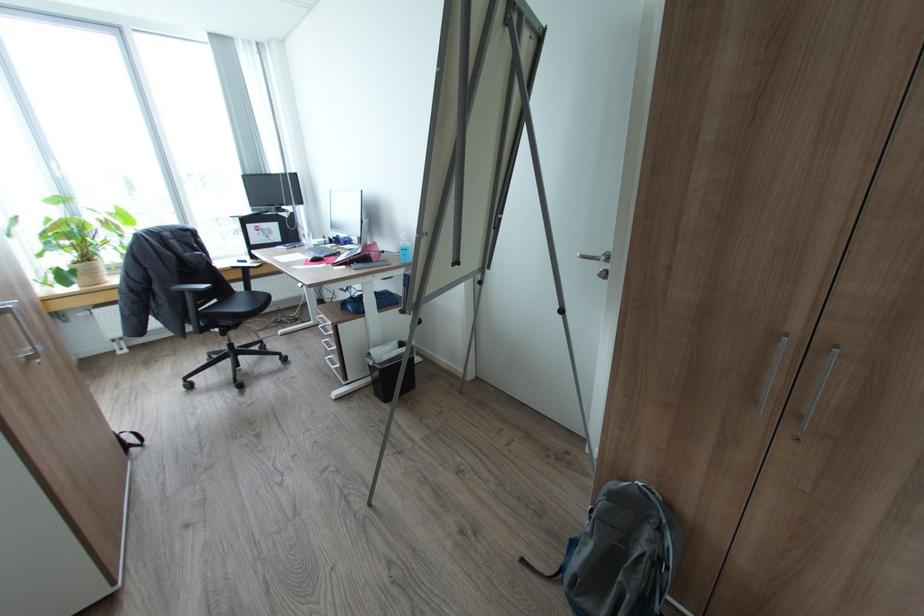
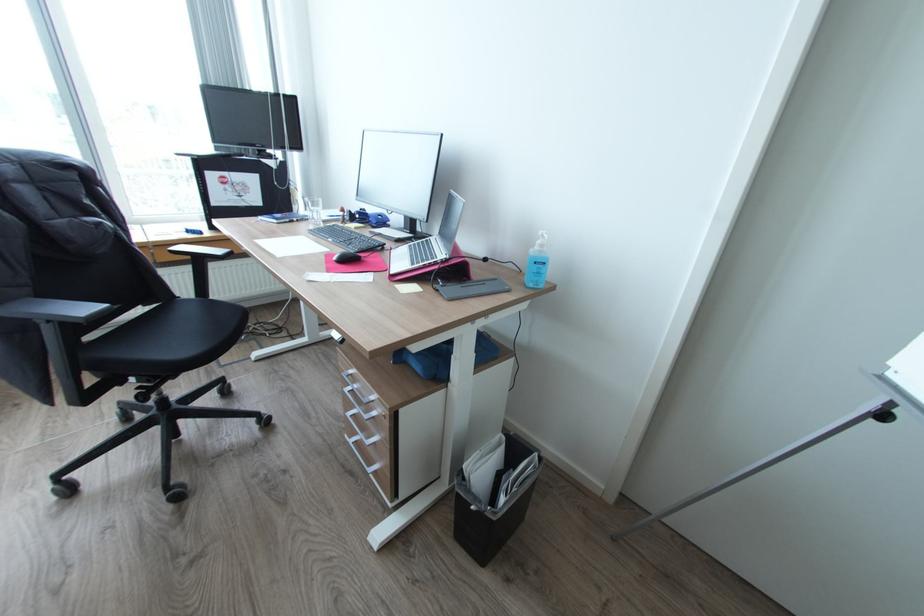
Locate, in the second image, the point that corresponds to [310,264] in the first image.

(334, 270)